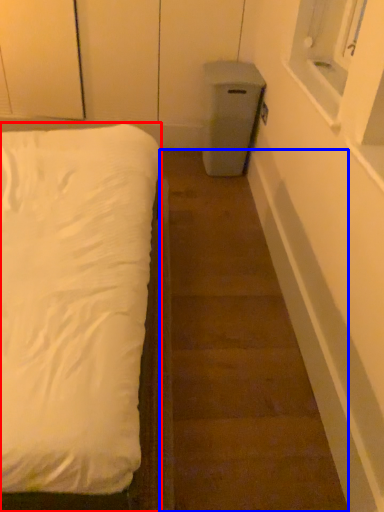
Question: Which of the following is the closest to the observer, bed (highlighted by a red box) or stairwell (highlighted by a blue box)?

Choices:
 (A) bed
 (B) stairwell

Answer: (A)